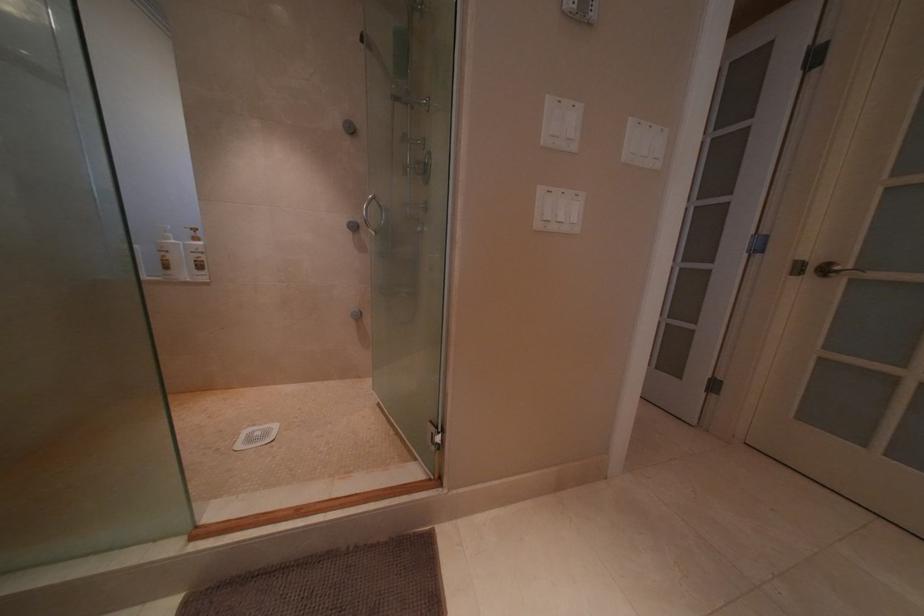
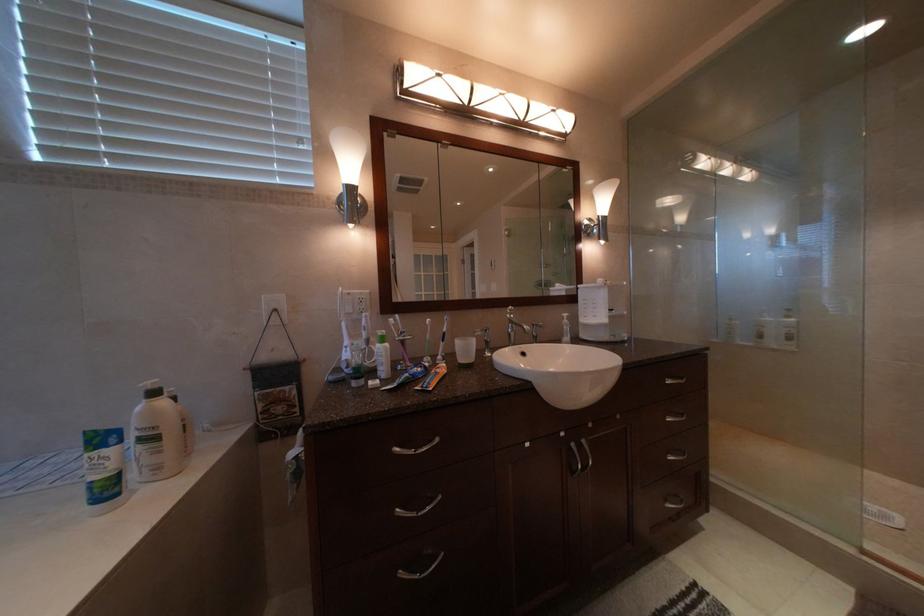
Question: The images are taken continuously from a first-person perspective. In which direction is your viewpoint rotating?

Choices:
 (A) Left
 (B) Right
 (C) Up
 (D) Down

Answer: (A)